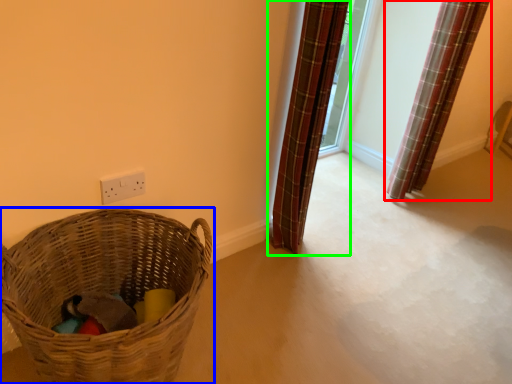
Question: Which object is the farthest from curtain (highlighted by a red box)? Choose among these: picnic basket (highlighted by a blue box) or curtain (highlighted by a green box).

Choices:
 (A) picnic basket
 (B) curtain

Answer: (A)